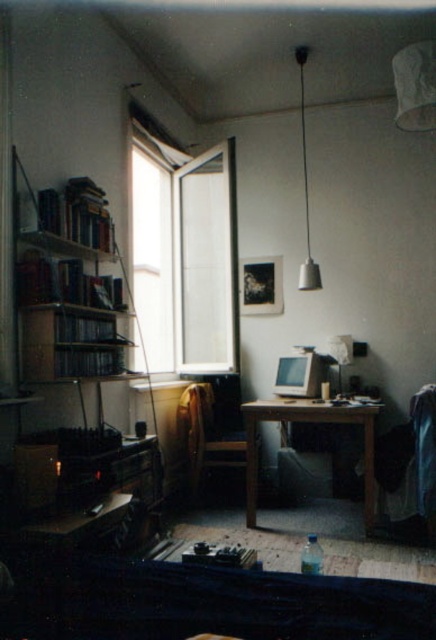
Can you confirm if wooden chair at center is positioned below metallic silver lampshade at upper center?

Yes, wooden chair at center is below metallic silver lampshade at upper center.

Does wooden chair at center have a larger size compared to metallic silver lampshade at upper center?

Yes, wooden chair at center is bigger than metallic silver lampshade at upper center.

Where is `wooden chair at center`? The width and height of the screenshot is (436, 640). wooden chair at center is located at coordinates (207, 435).

Does wooden bookshelf at left have a greater width compared to wooden table at center?

In fact, wooden bookshelf at left might be narrower than wooden table at center.

Identify the location of wooden bookshelf at left. The width and height of the screenshot is (436, 640). (71, 284).

Between point (44, 369) and point (296, 401), which one is positioned in front?

Positioned in front is point (44, 369).

Where is `wooden bookshelf at left`? wooden bookshelf at left is located at coordinates (71, 284).

Can you confirm if wooden bookshelf at left is bigger than wooden chair at center?

Correct, wooden bookshelf at left is larger in size than wooden chair at center.

The width and height of the screenshot is (436, 640). What are the coordinates of `wooden bookshelf at left` in the screenshot? It's located at (71, 284).

Which is in front, point (44, 195) or point (255, 465)?

Point (44, 195)

Where is `wooden bookshelf at left`? wooden bookshelf at left is located at coordinates (71, 284).